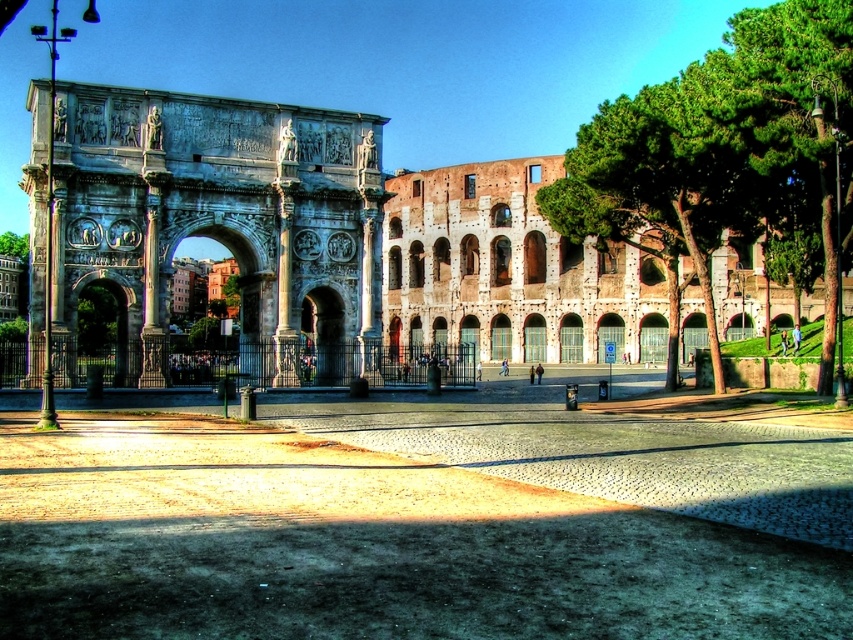
You are standing in the plaza in front of the Arch of Constantine and the Colosseum. You notice two points marked on the ground at coordinates point (171, 145) and point (751, 212). Which point is closer to your current position?

Point (171, 145) is closer to the camera than point (751, 212), so the point closer to your current position is point (171, 145).

You are an architect visiting Rome and want to compare the widths of the stone archway at left and the green leafy tree at right in the scene. Which one has a greater width?

The green leafy tree at right has a greater width than the stone archway at left.